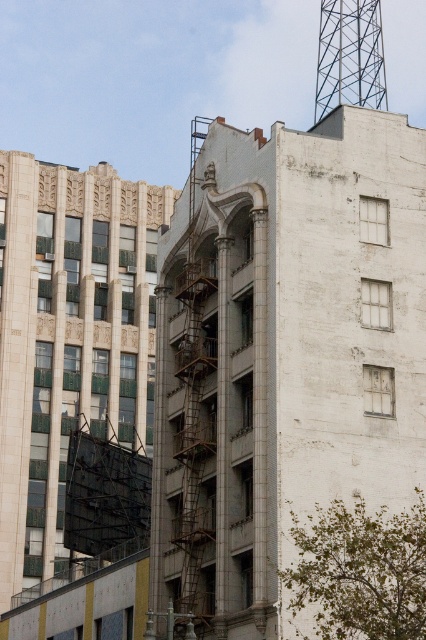
You are a window washer who needs to clean both the white concrete fire escape at upper center and the metallic lattice tower at upper right. Which one requires you to use a taller ladder?

The white concrete fire escape at upper center is taller than the metallic lattice tower at upper right, so you need a taller ladder for the white concrete fire escape at upper center.

In the scene shown: You are standing on the sidewalk in front of these two buildings. You notice the white concrete fire escape at upper center and the beige stone tower at upper left. Which object is located to the right of the other?

The white concrete fire escape at upper center is positioned on the right side of beige stone tower at upper left.

You are a window cleaner needing to access the upper floors of both the white concrete fire escape at upper center and the beige stone tower at upper left. Which structure would require a longer ladder due to its height?

The white concrete fire escape at upper center is larger in size than the beige stone tower at upper left, so it is taller. Therefore, accessing its upper floors would require a longer ladder.